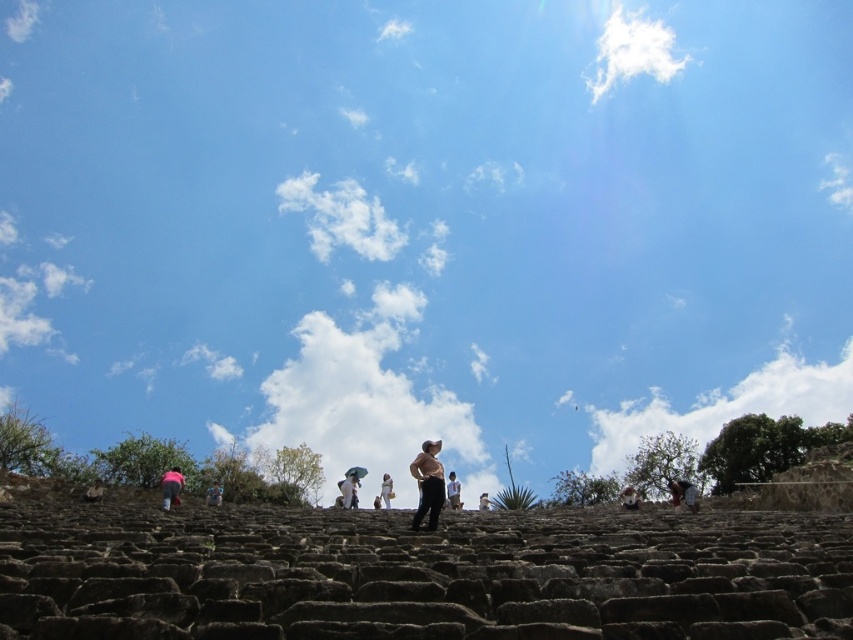
Find the location of `dark brown leather pants at center`. dark brown leather pants at center is located at coordinates (453, 492).

What are the coordinates of `dark brown leather pants at center` in the screenshot? It's located at (453, 492).

You are a GUI agent. You are given a task and a screenshot of the screen. Output one action in this format:
    pyautogui.click(x=<x>, y=<y>)
    Task: Click on the dark brown leather pants at center
    This screenshot has width=853, height=640.
    Given the screenshot: What is the action you would take?
    pyautogui.click(x=453, y=492)

Does dark brown leather pants at center appear on the left side of light brown fabric bag at center?

No, dark brown leather pants at center is not to the left of light brown fabric bag at center.

Who is lower down, dark brown leather pants at center or light brown fabric bag at center?

light brown fabric bag at center

Which is behind, point (451, 506) or point (386, 506)?

The point (386, 506) is more distant.

The image size is (853, 640). I want to click on dark brown leather pants at center, so click(x=453, y=492).

Who is shorter, pink fabric at lower left or brown leather jacket at center?

With less height is brown leather jacket at center.

Looking at this image, who is taller, pink fabric at lower left or brown leather jacket at center?

Standing taller between the two is pink fabric at lower left.

Is point (183, 477) closer to viewer compared to point (630, 509)?

Yes, point (183, 477) is in front of point (630, 509).

Find the location of a particular element. The image size is (853, 640). pink fabric at lower left is located at coordinates (171, 486).